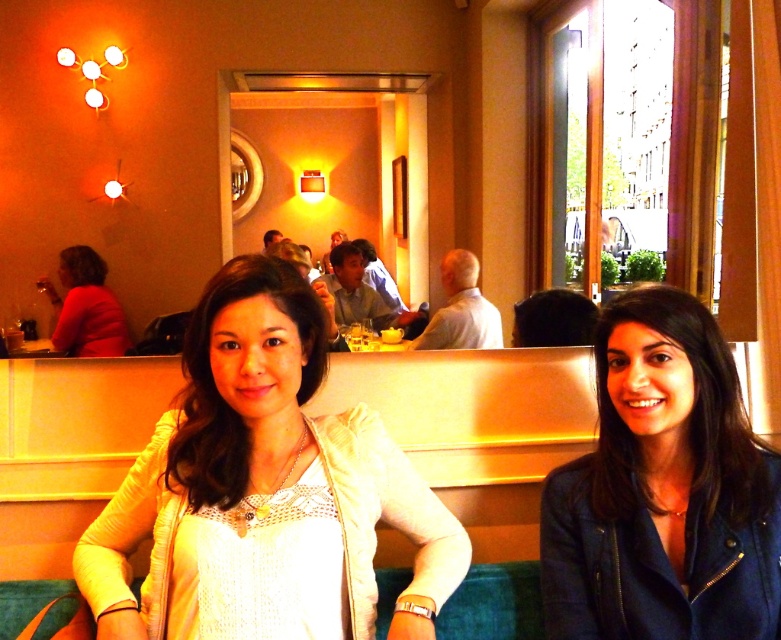
You are a photographer trying to capture the white lace top at center and the matte red shirt at left in the same frame. Which one is closer to the camera?

The white lace top at center is closer to the camera because it is in front of the matte red shirt at left.